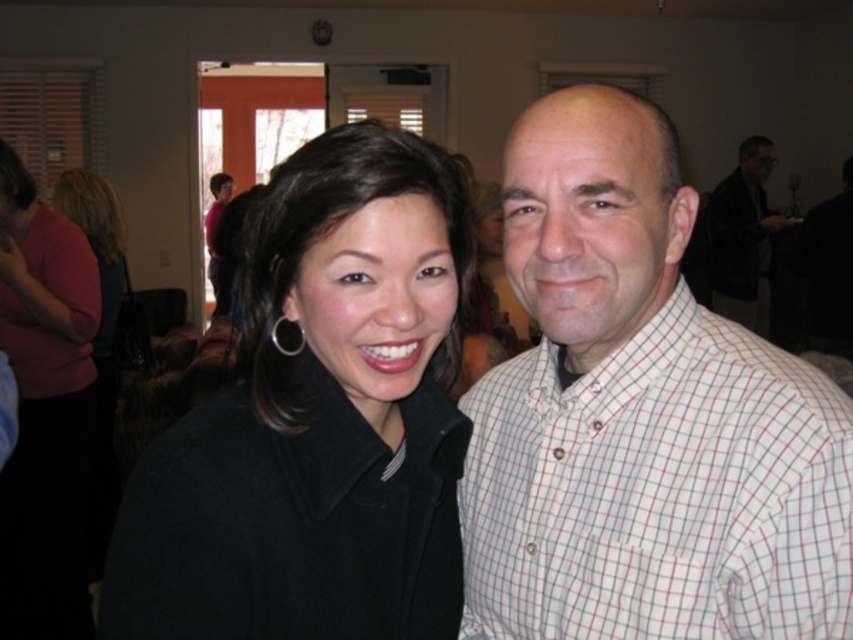
Can you confirm if black wool coat at center is shorter than dark gray suit at right?

Indeed, black wool coat at center has a lesser height compared to dark gray suit at right.

Where is `black wool coat at center`? black wool coat at center is located at coordinates pos(318,420).

Can you confirm if white checkered shirt at right is bigger than matte black coat at center?

Actually, white checkered shirt at right might be smaller than matte black coat at center.

Which of these two, white checkered shirt at right or matte black coat at center, stands taller?

With more height is matte black coat at center.

Is point (605, 586) closer to camera compared to point (24, 397)?

Yes, point (605, 586) is closer to viewer.

Where is `white checkered shirt at right`? white checkered shirt at right is located at coordinates (659, 492).

Is matte black coat at center in front of dark gray suit at right?

Yes, it is.

Does matte black coat at center have a lesser width compared to dark gray suit at right?

Yes, matte black coat at center is thinner than dark gray suit at right.

The width and height of the screenshot is (853, 640). What are the coordinates of `matte black coat at center` in the screenshot? It's located at (45, 412).